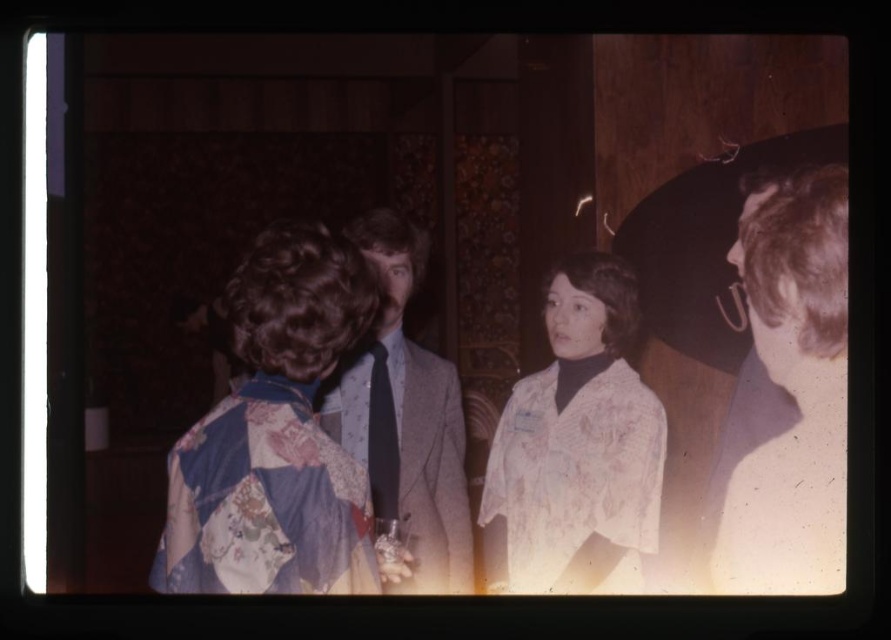
You are at a formal event and need to decide which item is larger between the floral fabric dress at center and the dark blue silk tie at center. Which one is bigger?

The floral fabric dress at center is bigger than the dark blue silk tie at center.

You are a photographer at the event and want to take a closeup of the dark blue silk tie at center without the floral fabric dress at center blocking it. What should you do?

Move the camera position to the side so that the dark blue silk tie at center is no longer behind the floral fabric dress at center.